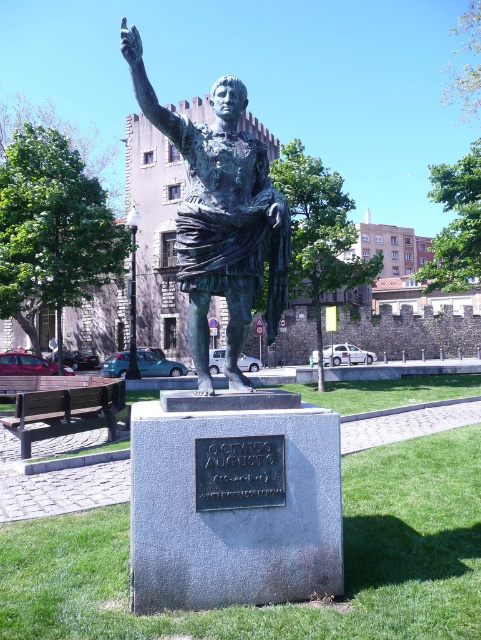
Measure the distance between bronze statue at center and black metal plaque at center.

They are 27.69 inches apart.

Does bronze statue at center have a lesser width compared to black metal plaque at center?

In fact, bronze statue at center might be wider than black metal plaque at center.

Who is more forward, (243, 342) or (206, 440)?

Point (206, 440) is in front.

Locate an element on the screen. This screenshot has height=640, width=481. bronze statue at center is located at coordinates (220, 218).